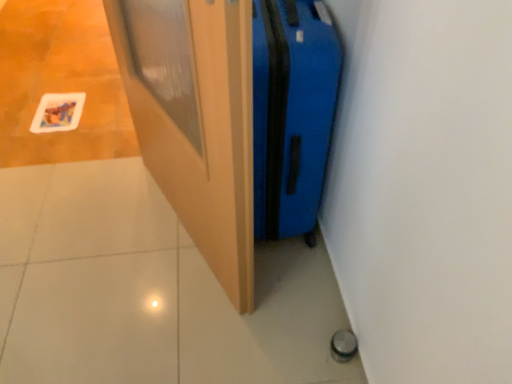
Question: Which is correct: blue hardshell suitcase at center-right is inside wooden door at center, or outside of it?

Choices:
 (A) outside
 (B) inside

Answer: (A)

Question: Is blue hardshell suitcase at center-right wider or thinner than wooden door at center?

Choices:
 (A) wide
 (B) thin

Answer: (A)

Question: In the image, is blue hardshell suitcase at center-right positioned in front of or behind wooden door at center?

Choices:
 (A) behind
 (B) front

Answer: (A)

Question: Based on their positions, is wooden door at center located to the left or right of blue hardshell suitcase at center-right?

Choices:
 (A) right
 (B) left

Answer: (B)

Question: From the image's perspective, is wooden door at center above or below blue hardshell suitcase at center-right?

Choices:
 (A) above
 (B) below

Answer: (B)

Question: In terms of height, does wooden door at center look taller or shorter compared to blue hardshell suitcase at center-right?

Choices:
 (A) short
 (B) tall

Answer: (B)

Question: From a real-world perspective, is wooden door at center positioned above or below blue hardshell suitcase at center-right?

Choices:
 (A) above
 (B) below

Answer: (A)